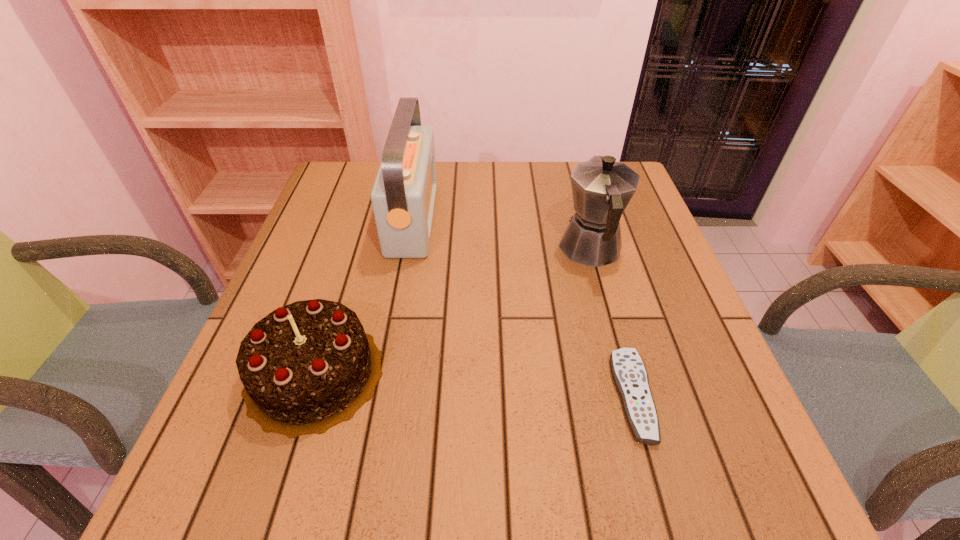
The image size is (960, 540). Find the location of `radio receiver`. radio receiver is located at coordinates (403, 197).

The height and width of the screenshot is (540, 960). In order to click on coffeepot in this screenshot , I will do `click(601, 188)`.

You are a GUI agent. You are given a task and a screenshot of the screen. Output one action in this format:
    pyautogui.click(x=<x>, y=<y>)
    Task: Click on the birthday cake
    
    Given the screenshot: What is the action you would take?
    pyautogui.click(x=307, y=366)

Image resolution: width=960 pixels, height=540 pixels. In order to click on remote control in this screenshot , I will do tap(629, 373).

The width and height of the screenshot is (960, 540). I want to click on vacant space situated 0.090m on the front-facing side of the radio receiver, so click(468, 218).

In order to click on free space located 0.210m at the spout of the coffeepot in this screenshot , I will do `click(571, 179)`.

You are a GUI agent. You are given a task and a screenshot of the screen. Output one action in this format:
    pyautogui.click(x=<x>, y=<y>)
    Task: Click on the vacant area situated 0.130m at the spout of the coffeepot
    This screenshot has height=540, width=960.
    Given the screenshot: What is the action you would take?
    pyautogui.click(x=576, y=194)

The width and height of the screenshot is (960, 540). In order to click on vacant space located at the spout of the coffeepot in this screenshot , I will do (x=579, y=205).

You are a GUI agent. You are given a task and a screenshot of the screen. Output one action in this format:
    pyautogui.click(x=<x>, y=<y>)
    Task: Click on the free spot located 0.050m on the right of the birthday cake
    This screenshot has width=960, height=540.
    Given the screenshot: What is the action you would take?
    pyautogui.click(x=410, y=373)

Where is `free space located 0.160m on the back of the shortest object`? The width and height of the screenshot is (960, 540). free space located 0.160m on the back of the shortest object is located at coordinates (605, 293).